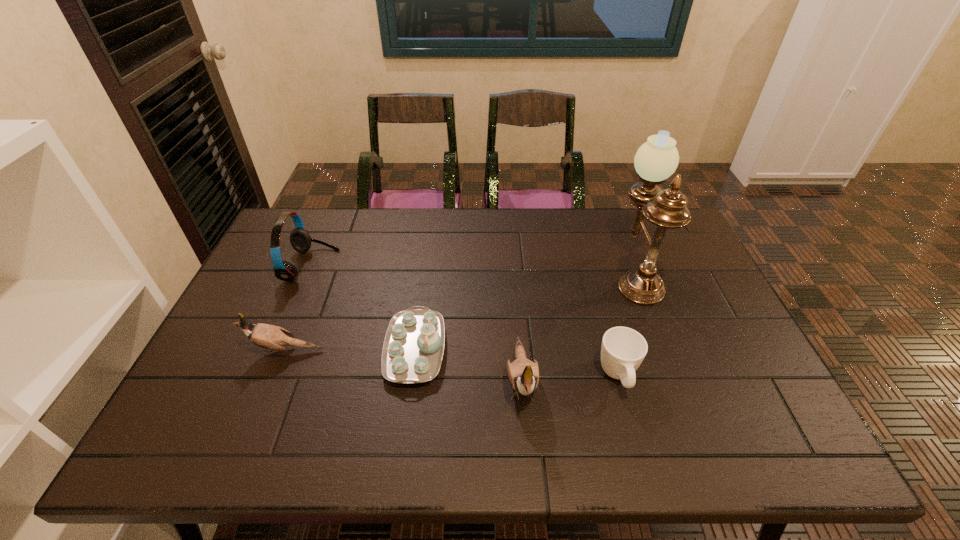
I want to click on blank space located 0.390m with the microphone attached to the side of the headset, so click(459, 266).

This screenshot has height=540, width=960. What are the coordinates of `free space located 0.250m on the left of the rightmost object` in the screenshot? It's located at (533, 273).

At what (x,y) coordinates should I click in order to perform the action: click on free spot located on the right of the third object from left to right. Please return your answer as a coordinate pair (x, y). This screenshot has width=960, height=540. Looking at the image, I should click on (568, 349).

The height and width of the screenshot is (540, 960). In order to click on headset that is at the far edge in this screenshot , I will do click(300, 239).

Where is `oil lamp positioned at the far edge`? This screenshot has width=960, height=540. oil lamp positioned at the far edge is located at coordinates (657, 159).

At what (x,y) coordinates should I click in order to perform the action: click on bird located at the near edge. Please return your answer as a coordinate pair (x, y). This screenshot has width=960, height=540. Looking at the image, I should click on (523, 375).

At what (x,y) coordinates should I click in order to perform the action: click on chinaware present at the near edge. Please return your answer as a coordinate pair (x, y). Image resolution: width=960 pixels, height=540 pixels. Looking at the image, I should click on (413, 348).

Image resolution: width=960 pixels, height=540 pixels. Find the location of `cup present at the near edge`. cup present at the near edge is located at coordinates (623, 349).

Identify the location of bird situated at the left edge. The height and width of the screenshot is (540, 960). (266, 336).

This screenshot has height=540, width=960. In order to click on headset that is at the left edge in this screenshot , I will do `click(300, 239)`.